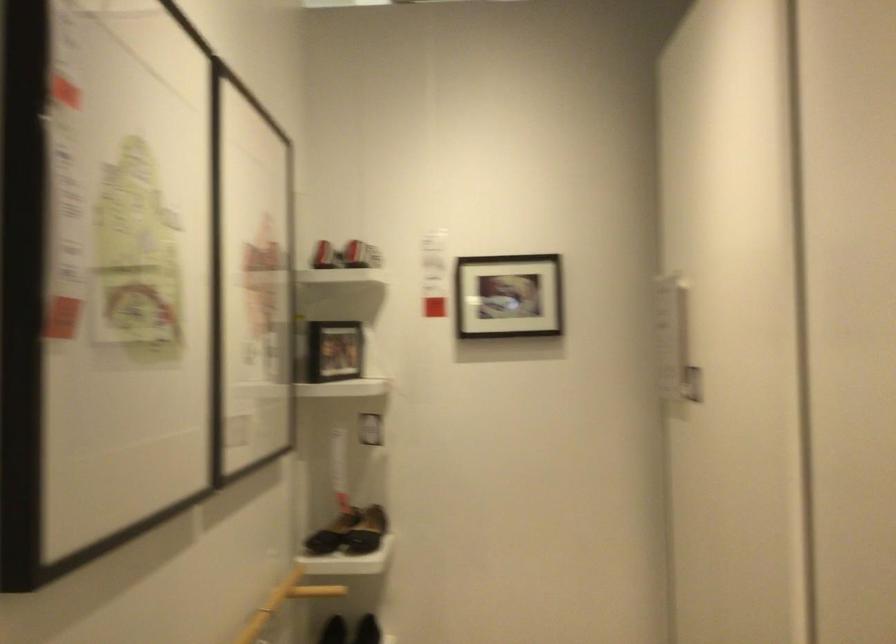
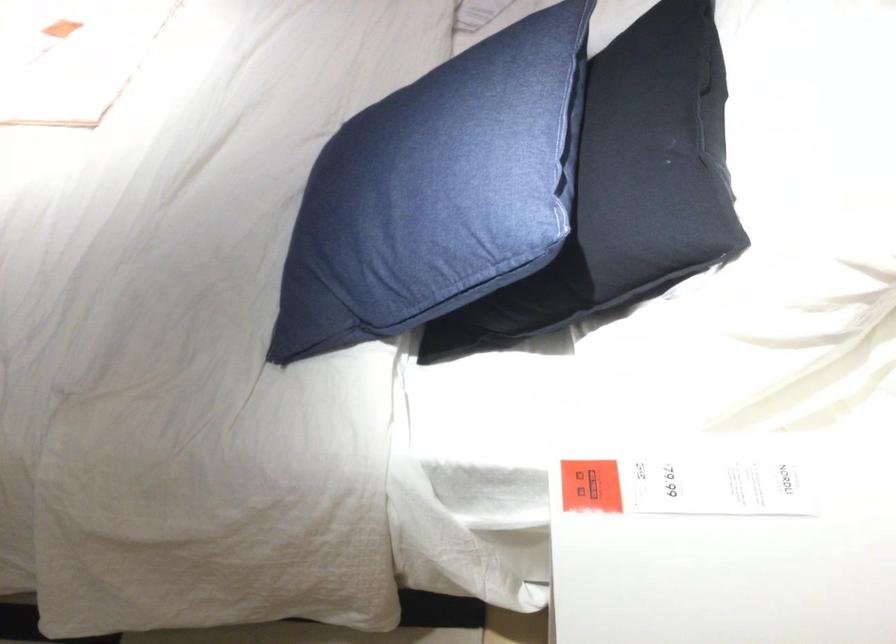
The first image is from the beginning of the video and the second image is from the end. How did the camera likely rotate when shooting the video?

The camera rotated toward left-down.